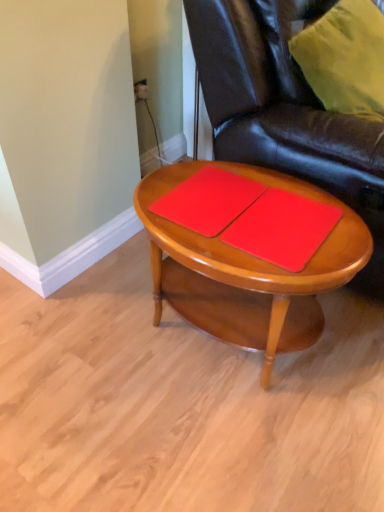
The width and height of the screenshot is (384, 512). In order to click on matte red notebook at center, the 1th notebook from the left in this screenshot , I will do `click(208, 200)`.

Describe the element at coordinates (208, 200) in the screenshot. I see `matte red notebook at center, the 1th notebook from the left` at that location.

At what (x,y) coordinates should I click in order to perform the action: click on glossy leather chair at center. Please return your answer as a coordinate pair (x, y). Looking at the image, I should click on (285, 111).

Can you see red matte notebook at center, which appears as the first notebook when viewed from the right, touching matte red notebook at center, which is the 2th notebook in right-to-left order?

red matte notebook at center, which appears as the first notebook when viewed from the right, and matte red notebook at center, which is the 2th notebook in right-to-left order, are not in contact.

Which of these two, red matte notebook at center, acting as the 2th notebook starting from the left, or matte red notebook at center, the 1th notebook from the left, is wider?

red matte notebook at center, acting as the 2th notebook starting from the left.

Could you tell me if red matte notebook at center, acting as the 2th notebook starting from the left, is turned towards matte red notebook at center, which is the 2th notebook in right-to-left order?

No, red matte notebook at center, acting as the 2th notebook starting from the left, is not aimed at matte red notebook at center, which is the 2th notebook in right-to-left order.

In the scene shown: Choose the correct answer: Is red matte notebook at center, which appears as the first notebook when viewed from the right, inside matte red notebook at center, the 1th notebook from the left, or outside it?

red matte notebook at center, which appears as the first notebook when viewed from the right, exists outside the volume of matte red notebook at center, the 1th notebook from the left.

Can you tell me how much glossy leather chair at center and matte red notebook at center, which is the 2th notebook in right-to-left order, differ in facing direction?

glossy leather chair at center and matte red notebook at center, which is the 2th notebook in right-to-left order, are facing 90 degrees away from each other.

From a real-world perspective, which notebook is the 2nd one underneath the glossy leather chair at center? Please provide its 2D coordinates.

[(208, 200)]

From a real-world perspective, is glossy leather chair at center above or below matte red notebook at center, the 1th notebook from the left?

Clearly, from a real-world perspective, glossy leather chair at center is above matte red notebook at center, the 1th notebook from the left.

Is glossy leather chair at center taller than matte red notebook at center, the 1th notebook from the left?

Indeed, glossy leather chair at center has a greater height compared to matte red notebook at center, the 1th notebook from the left.

Can you confirm if matte red notebook at center, which is the 2th notebook in right-to-left order, is positioned to the left of red matte notebook at center, acting as the 2th notebook starting from the left?

Yes, matte red notebook at center, which is the 2th notebook in right-to-left order, is to the left of red matte notebook at center, acting as the 2th notebook starting from the left.

Considering the positions of objects matte red notebook at center, which is the 2th notebook in right-to-left order, and red matte notebook at center, which appears as the first notebook when viewed from the right, in the image provided, who is behind, matte red notebook at center, which is the 2th notebook in right-to-left order, or red matte notebook at center, which appears as the first notebook when viewed from the right,?

matte red notebook at center, which is the 2th notebook in right-to-left order, is further from the camera.

From a real-world perspective, is matte red notebook at center, which is the 2th notebook in right-to-left order, positioned over red matte notebook at center, acting as the 2th notebook starting from the left, based on gravity?

No.

Is matte red notebook at center, which is the 2th notebook in right-to-left order, bigger or smaller than red matte notebook at center, acting as the 2th notebook starting from the left?

Considering their sizes, matte red notebook at center, which is the 2th notebook in right-to-left order, takes up less space than red matte notebook at center, acting as the 2th notebook starting from the left.

Is red matte notebook at center, acting as the 2th notebook starting from the left, wider or thinner than matte wood coffee table at center?

Clearly, red matte notebook at center, acting as the 2th notebook starting from the left, has less width compared to matte wood coffee table at center.

This screenshot has height=512, width=384. I want to click on coffee table on the left of red matte notebook at center, which appears as the first notebook when viewed from the right, so click(248, 254).

Would you say red matte notebook at center, which appears as the first notebook when viewed from the right, contains matte wood coffee table at center?

Answer: No, matte wood coffee table at center is not a part of red matte notebook at center, which appears as the first notebook when viewed from the right.

From a real-world perspective, relative to matte wood coffee table at center, is red matte notebook at center, acting as the 2th notebook starting from the left, vertically above or below?

In terms of real-world spatial position, red matte notebook at center, acting as the 2th notebook starting from the left, is above matte wood coffee table at center.

Does glossy leather chair at center come in front of red matte notebook at center, acting as the 2th notebook starting from the left?

Yes, the depth of glossy leather chair at center is less than that of red matte notebook at center, acting as the 2th notebook starting from the left.

Is the surface of glossy leather chair at center in direct contact with red matte notebook at center, which appears as the first notebook when viewed from the right?

No, glossy leather chair at center is not beside red matte notebook at center, which appears as the first notebook when viewed from the right.

How many degrees apart are the facing directions of glossy leather chair at center and red matte notebook at center, acting as the 2th notebook starting from the left?

The angle between the facing direction of glossy leather chair at center and the facing direction of red matte notebook at center, acting as the 2th notebook starting from the left, is 90 degrees.

Considering the sizes of objects glossy leather chair at center and red matte notebook at center, acting as the 2th notebook starting from the left, in the image provided, who is thinner, glossy leather chair at center or red matte notebook at center, acting as the 2th notebook starting from the left,?

Thinner between the two is red matte notebook at center, acting as the 2th notebook starting from the left.

Which object is positioned more to the right, matte red notebook at center, the 1th notebook from the left, or glossy leather chair at center?

glossy leather chair at center is more to the right.

Is matte red notebook at center, the 1th notebook from the left, taller or shorter than glossy leather chair at center?

In the image, matte red notebook at center, the 1th notebook from the left, appears to be shorter than glossy leather chair at center.

Can you see matte red notebook at center, which is the 2th notebook in right-to-left order, touching glossy leather chair at center?

matte red notebook at center, which is the 2th notebook in right-to-left order, and glossy leather chair at center are clearly separated.

Considering their positions, is matte red notebook at center, which is the 2th notebook in right-to-left order, located in front of or behind glossy leather chair at center?

matte red notebook at center, which is the 2th notebook in right-to-left order, is positioned farther from the viewer than glossy leather chair at center.

Considering the sizes of matte wood coffee table at center and red matte notebook at center, which appears as the first notebook when viewed from the right, in the image, is matte wood coffee table at center wider or thinner than red matte notebook at center, which appears as the first notebook when viewed from the right,?

In the image, matte wood coffee table at center appears to be wider than red matte notebook at center, which appears as the first notebook when viewed from the right.

Between matte wood coffee table at center and red matte notebook at center, acting as the 2th notebook starting from the left, which one appears on the right side from the viewer's perspective?

From the viewer's perspective, red matte notebook at center, acting as the 2th notebook starting from the left, appears more on the right side.

Which is closer to the camera, (337, 262) or (299, 242)?

The point (337, 262) is in front.

What's the angular difference between matte wood coffee table at center and red matte notebook at center, acting as the 2th notebook starting from the left,'s facing directions?

The angle between the facing direction of matte wood coffee table at center and the facing direction of red matte notebook at center, acting as the 2th notebook starting from the left, is 0.00014 degrees.

Where is `notebook above the matte red notebook at center, the 1th notebook from the left (from a real-world perspective)`? The width and height of the screenshot is (384, 512). notebook above the matte red notebook at center, the 1th notebook from the left (from a real-world perspective) is located at coordinates (282, 228).

The image size is (384, 512). There is a glossy leather chair at center. What are the coordinates of `the 1st notebook below it (from the image's perspective)` in the screenshot? It's located at coord(208,200).

Looking at the image, which one is located further to matte red notebook at center, the 1th notebook from the left, red matte notebook at center, acting as the 2th notebook starting from the left, or matte wood coffee table at center?

matte wood coffee table at center is positioned further to the anchor matte red notebook at center, the 1th notebook from the left.

When comparing their distances from red matte notebook at center, which appears as the first notebook when viewed from the right, does matte red notebook at center, which is the 2th notebook in right-to-left order, or glossy leather chair at center seem closer?

matte red notebook at center, which is the 2th notebook in right-to-left order.

Looking at the image, which one is located further to matte red notebook at center, the 1th notebook from the left, glossy leather chair at center or red matte notebook at center, acting as the 2th notebook starting from the left?

Based on the image, glossy leather chair at center appears to be further to matte red notebook at center, the 1th notebook from the left.

From the image, which object appears to be farther from glossy leather chair at center, red matte notebook at center, which appears as the first notebook when viewed from the right, or matte wood coffee table at center?

red matte notebook at center, which appears as the first notebook when viewed from the right, is positioned further to the anchor glossy leather chair at center.

Looking at the image, which one is located closer to red matte notebook at center, which appears as the first notebook when viewed from the right, matte wood coffee table at center or matte red notebook at center, the 1th notebook from the left?

matte wood coffee table at center is positioned closer to the anchor red matte notebook at center, which appears as the first notebook when viewed from the right.

Estimate the real-world distances between objects in this image. Which object is closer to matte wood coffee table at center, red matte notebook at center, which appears as the first notebook when viewed from the right, or matte red notebook at center, which is the 2th notebook in right-to-left order?

Based on the image, red matte notebook at center, which appears as the first notebook when viewed from the right, appears to be nearer to matte wood coffee table at center.

Based on their spatial positions, is glossy leather chair at center or matte red notebook at center, the 1th notebook from the left, further from red matte notebook at center, acting as the 2th notebook starting from the left?

glossy leather chair at center is positioned further to the anchor red matte notebook at center, acting as the 2th notebook starting from the left.

Which object lies further to the anchor point matte red notebook at center, which is the 2th notebook in right-to-left order, glossy leather chair at center or matte wood coffee table at center?

glossy leather chair at center is positioned further to the anchor matte red notebook at center, which is the 2th notebook in right-to-left order.

This screenshot has height=512, width=384. I want to click on notebook located between matte red notebook at center, the 1th notebook from the left, and glossy leather chair at center in the left-right direction, so click(282, 228).

The image size is (384, 512). Find the location of `notebook between matte red notebook at center, which is the 2th notebook in right-to-left order, and matte wood coffee table at center in the up-down direction`. notebook between matte red notebook at center, which is the 2th notebook in right-to-left order, and matte wood coffee table at center in the up-down direction is located at coordinates (282, 228).

The width and height of the screenshot is (384, 512). Identify the location of coffee table located between matte red notebook at center, the 1th notebook from the left, and glossy leather chair at center in the left-right direction. (248, 254).